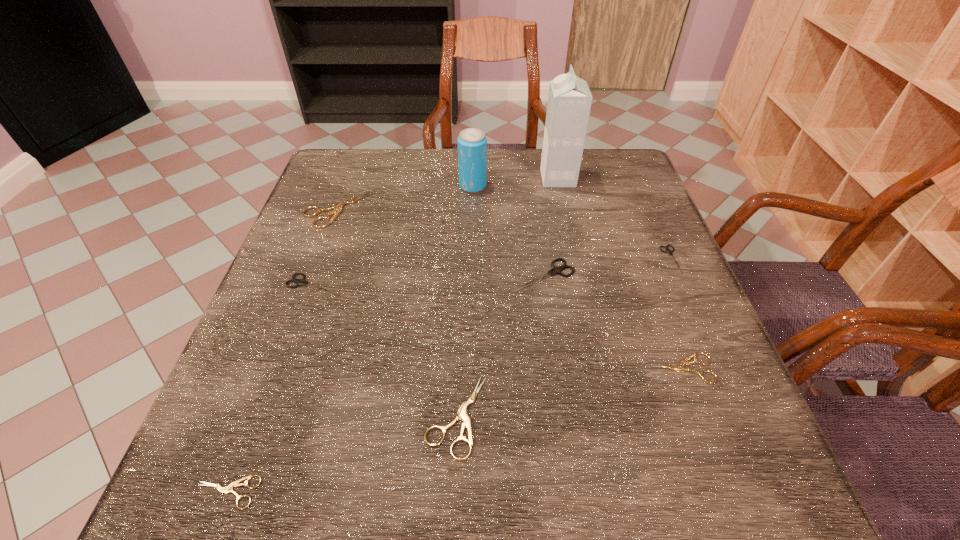
Where is `the smallest black shears`? the smallest black shears is located at coordinates (668, 251).

Find the location of a particular element. This screenshot has width=960, height=540. the nearest shears is located at coordinates (228, 489).

What are the coordinates of `the shortest object` in the screenshot? It's located at (228, 489).

Find the location of a particular element. free region located on the front label of the tallest object is located at coordinates (403, 178).

Image resolution: width=960 pixels, height=540 pixels. I want to click on free space located 0.110m on the front label of the tallest object, so click(x=501, y=178).

Identify the location of vacant region located 0.170m on the front label of the tallest object. Image resolution: width=960 pixels, height=540 pixels. tap(480, 178).

The width and height of the screenshot is (960, 540). Identify the location of vacant space located 0.320m on the front of the soda can. (471, 282).

Locate an element on the screen. The image size is (960, 540). free space located on the left of the biggest black shears is located at coordinates (366, 275).

Where is `vacant space situated 0.400m on the front of the farthest shears`? The image size is (960, 540). vacant space situated 0.400m on the front of the farthest shears is located at coordinates (276, 374).

This screenshot has height=540, width=960. Identify the location of vacant space located 0.200m on the right of the leftmost black shears. pyautogui.click(x=437, y=284).